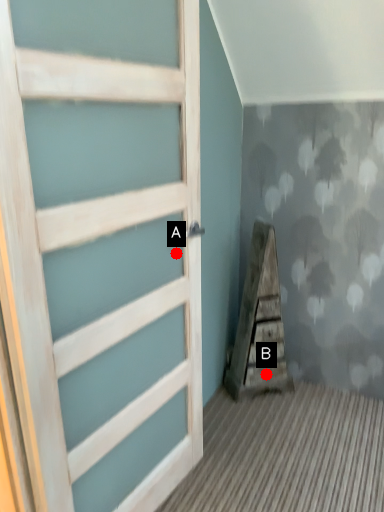
Question: Two points are circled on the image, labeled by A and B beside each circle. Which point is farther to the camera?

Choices:
 (A) A is further
 (B) B is further

Answer: (B)